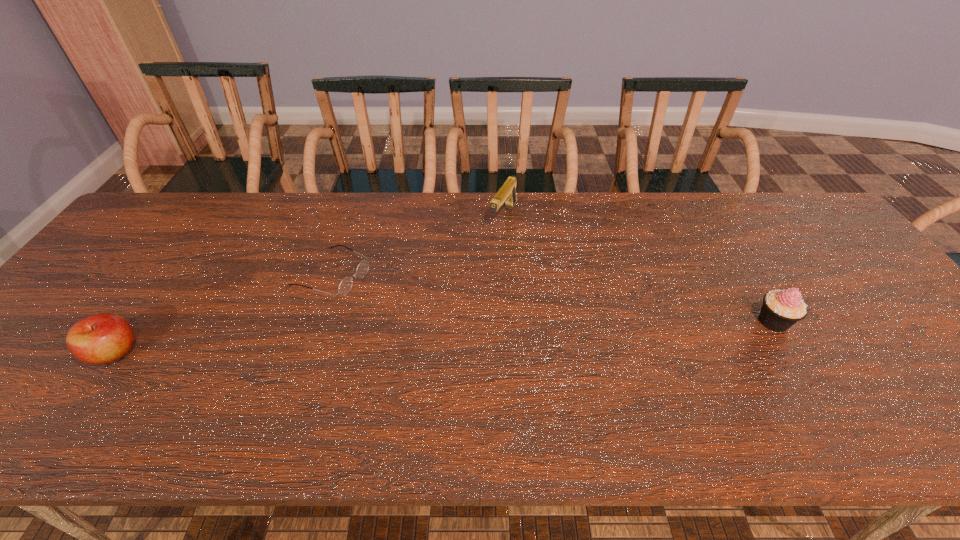
Find the location of a particular element. The height and width of the screenshot is (540, 960). free space between the cupcake and the spectacles is located at coordinates (553, 298).

You are a GUI agent. You are given a task and a screenshot of the screen. Output one action in this format:
    pyautogui.click(x=<x>, y=<y>)
    Task: Click on the empty space between the rightmost object and the third nearest object
    This screenshot has width=960, height=540.
    Given the screenshot: What is the action you would take?
    pyautogui.click(x=553, y=298)

I want to click on vacant space that's between the spectacles and the apple, so click(x=224, y=313).

Where is `vacant area that lies between the apple and the rightmost object`? This screenshot has height=540, width=960. vacant area that lies between the apple and the rightmost object is located at coordinates (444, 337).

Locate an element on the screen. This screenshot has width=960, height=540. object that ranks as the third closest to the shortest object is located at coordinates (781, 309).

At what (x,y) coordinates should I click in order to perform the action: click on object that is the third closest to the apple. Please return your answer as a coordinate pair (x, y). The image size is (960, 540). Looking at the image, I should click on (781, 309).